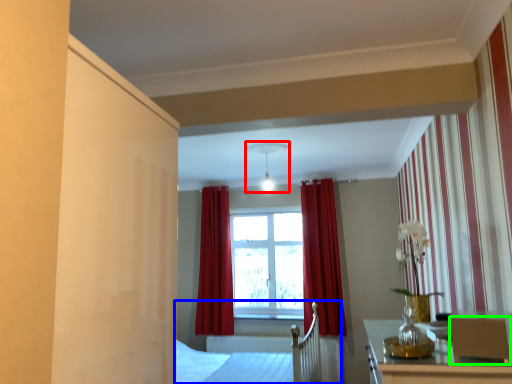
Question: Which object is the closest to the light fixture (highlighted by a red box)? Choose among these: bed frame (highlighted by a blue box) or armchair (highlighted by a green box).

Choices:
 (A) bed frame
 (B) armchair

Answer: (A)